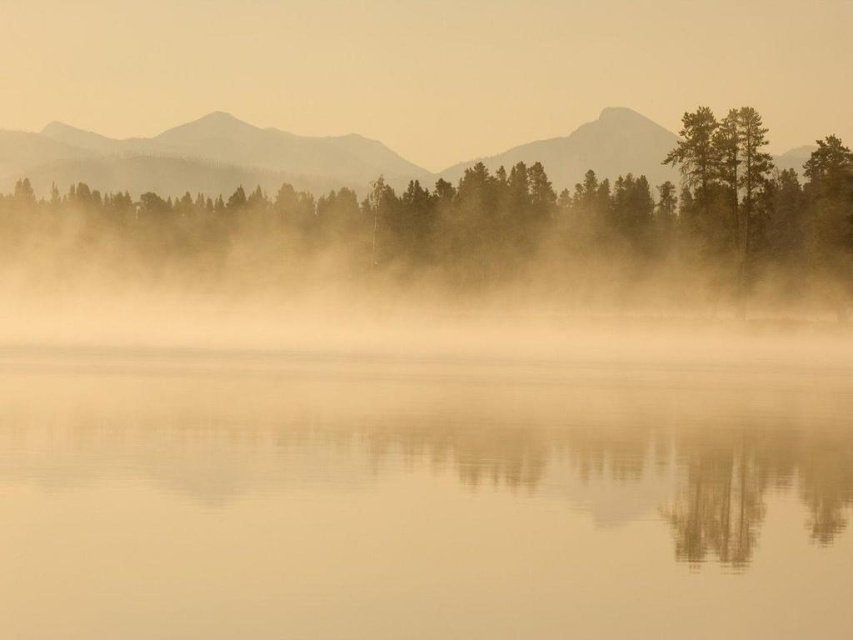
Question: Which point is closer to the camera taking this photo?

Choices:
 (A) (320, 189)
 (B) (572, 568)

Answer: (B)

Question: Is smooth water at center wider than green matte tree at center?

Choices:
 (A) no
 (B) yes

Answer: (A)

Question: Which of the following is the farthest from the observer?

Choices:
 (A) (529, 168)
 (B) (527, 449)

Answer: (A)

Question: Where is smooth water at center located in relation to green matte tree at center in the image?

Choices:
 (A) right
 (B) left

Answer: (A)

Question: Is smooth water at center wider than green matte tree at center?

Choices:
 (A) no
 (B) yes

Answer: (A)

Question: Which of the following is the farthest from the observer?

Choices:
 (A) (299, 400)
 (B) (817, 176)

Answer: (B)